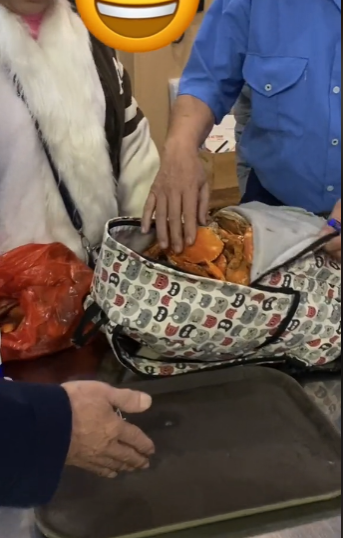
The image size is (343, 538). I want to click on gray rectangular shaped tray, so click(x=210, y=486).